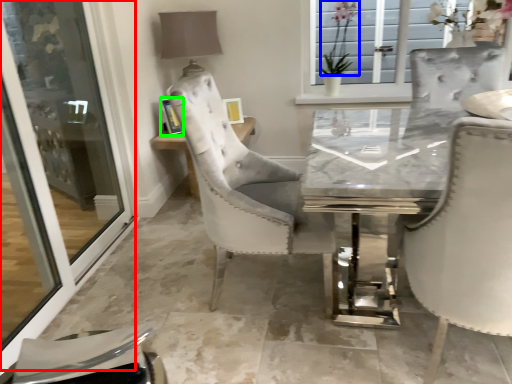
Question: Which object is positioned closest to screen door (highlighted by a red box)? Select from flower (highlighted by a blue box) and picture frame (highlighted by a green box).

Choices:
 (A) flower
 (B) picture frame

Answer: (B)